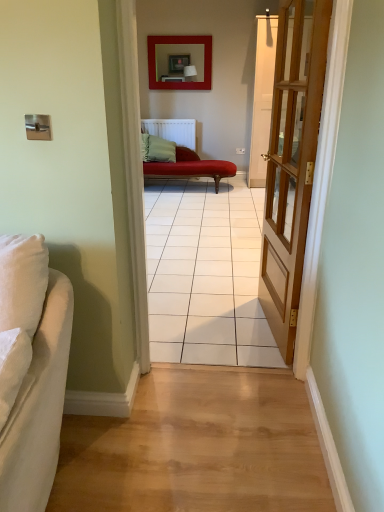
Locate an element on the screen. free point behind light brown wooden door at right is located at coordinates (234, 296).